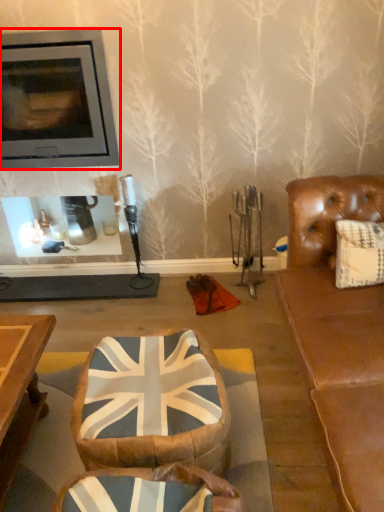
Question: From the image, what is the correct spatial relationship of fireplace (annotated by the red box) in relation to bean bag chair?

Choices:
 (A) left
 (B) right

Answer: (A)